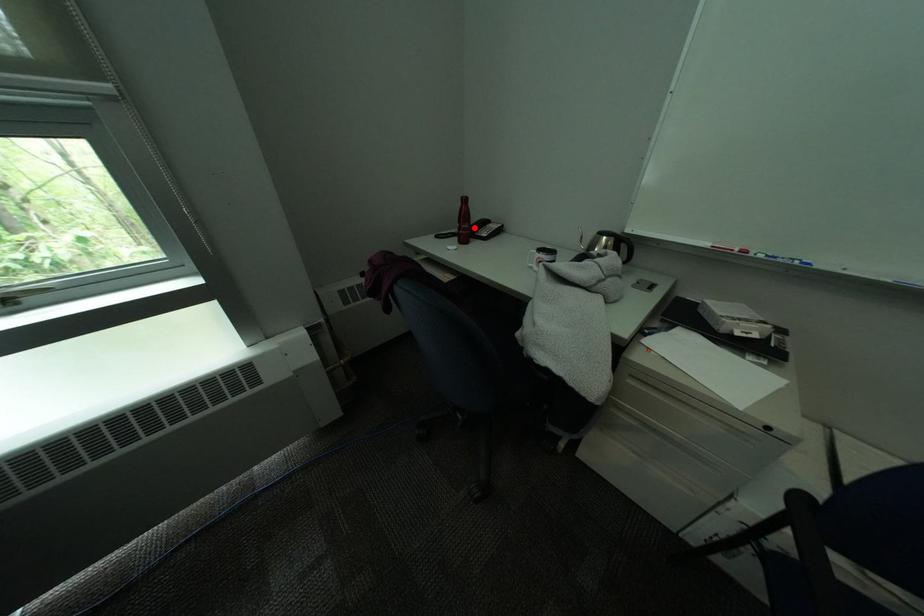
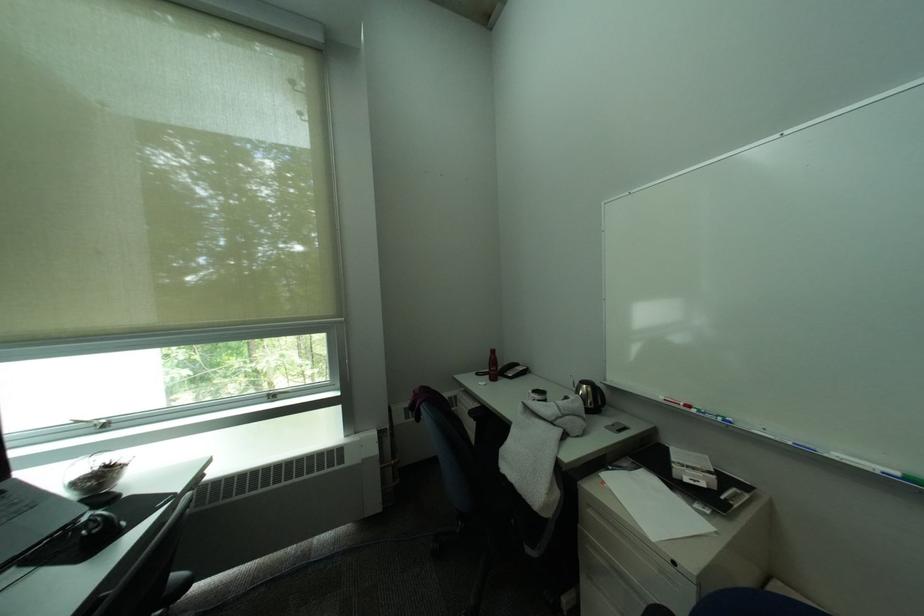
Where in the second image is the point corresponding to the highlighted location from the first image?

(503, 370)